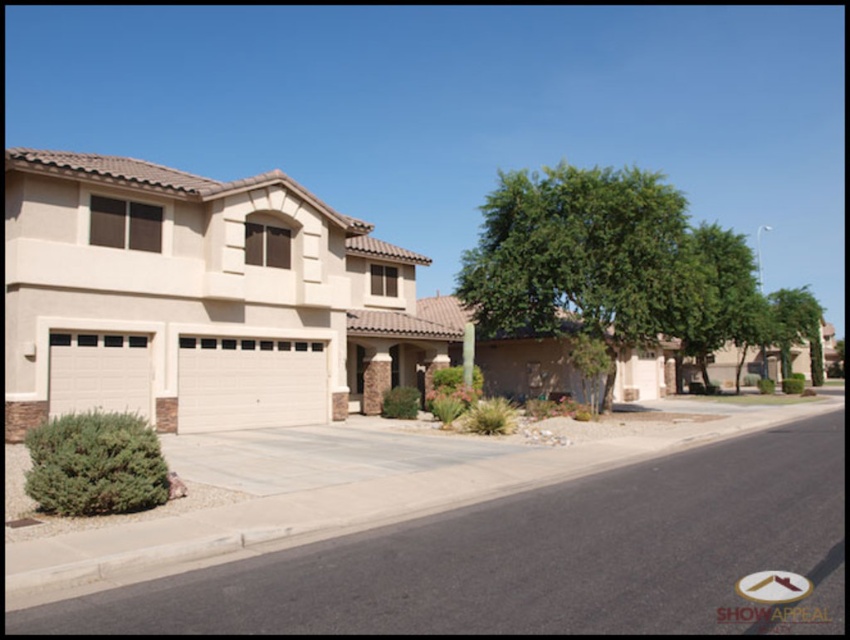
You are standing at the point marked as point (536, 557) in the image. What surface are you currently standing on?

You are standing on the gray concrete driveway at center.

You are standing at the entrance of the house and want to open the beige textured garage door at center. According to the coordinates provided, where exactly is the beige textured garage door located?

The beige textured garage door at center is located at coordinates point [248,381].

You are a delivery person trying to park your van in the driveway. The white textured garage door at lower left and the green leafy tree at right are in your way. Which one should you move to make more space for your van?

The white textured garage door at lower left occupies less space than the green leafy tree at right, so you should move the white textured garage door at lower left to make more space for your van.